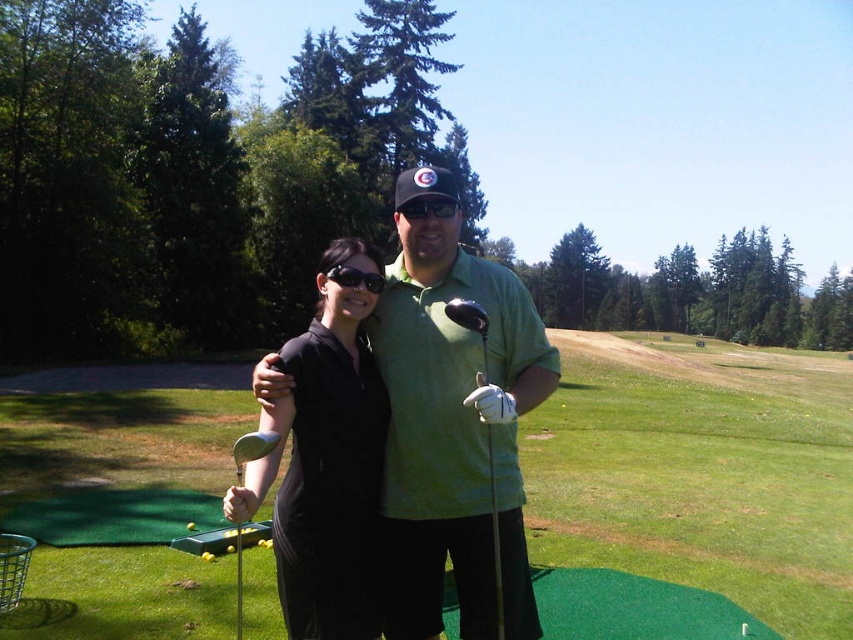
Question: Which object is positioned closest to the yellow matte golf ball at center?

Choices:
 (A) black reflective sunglasses at center
 (B) metallic silver golf club at center
 (C) green artificial turf at center

Answer: (B)

Question: Based on their relative distances, which object is nearer to the black matte golf club at center?

Choices:
 (A) metallic silver golf club at center
 (B) shiny black metal golf club at center
 (C) yellow matte golf ball at center
 (D) black matte cap at center

Answer: (D)

Question: Is the position of shiny black metal golf club at center less distant than that of black matte cap at center?

Choices:
 (A) yes
 (B) no

Answer: (A)

Question: Among these objects, which one is farthest from the camera?

Choices:
 (A) metallic silver golf club at center
 (B) black matte golf club at center
 (C) green matte golf shirt at center

Answer: (C)

Question: Is green artificial turf at center bigger than black matte cap at center?

Choices:
 (A) yes
 (B) no

Answer: (A)

Question: Is green artificial turf at center positioned before yellow matte golf ball at center?

Choices:
 (A) yes
 (B) no

Answer: (A)